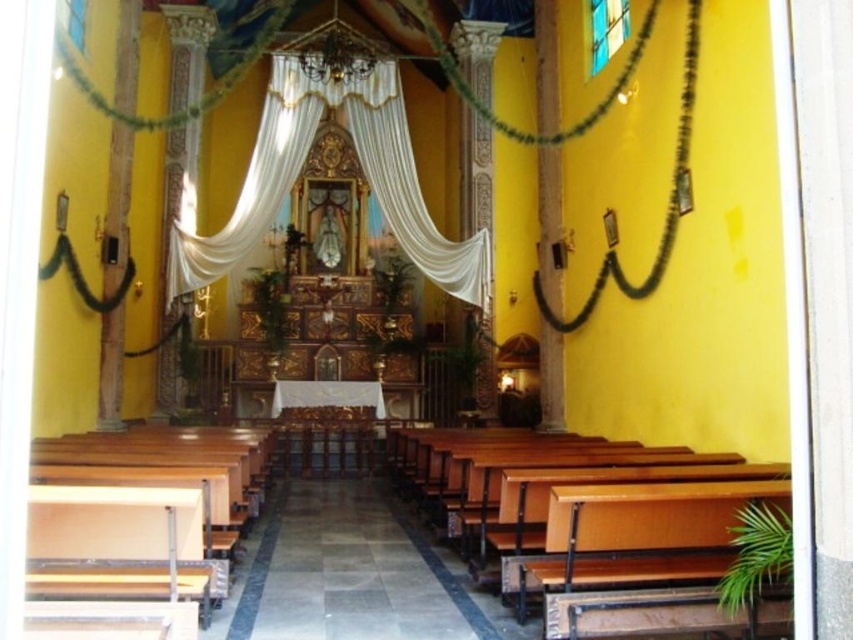
How far apart are wooden church bench at center and white sheer curtain at center?

wooden church bench at center is 22.64 meters from white sheer curtain at center.

Between wooden church bench at center and white sheer curtain at center, which one has more height?

With more height is white sheer curtain at center.

Locate an element on the screen. Image resolution: width=853 pixels, height=640 pixels. wooden church bench at center is located at coordinates (604, 531).